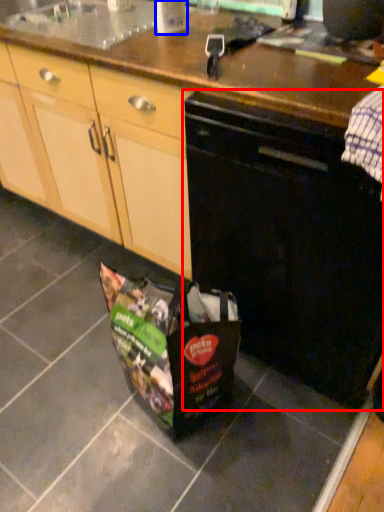
Question: Which point is further to the camera, home appliance (highlighted by a red box) or kitchen appliance (highlighted by a blue box)?

Choices:
 (A) home appliance
 (B) kitchen appliance

Answer: (B)